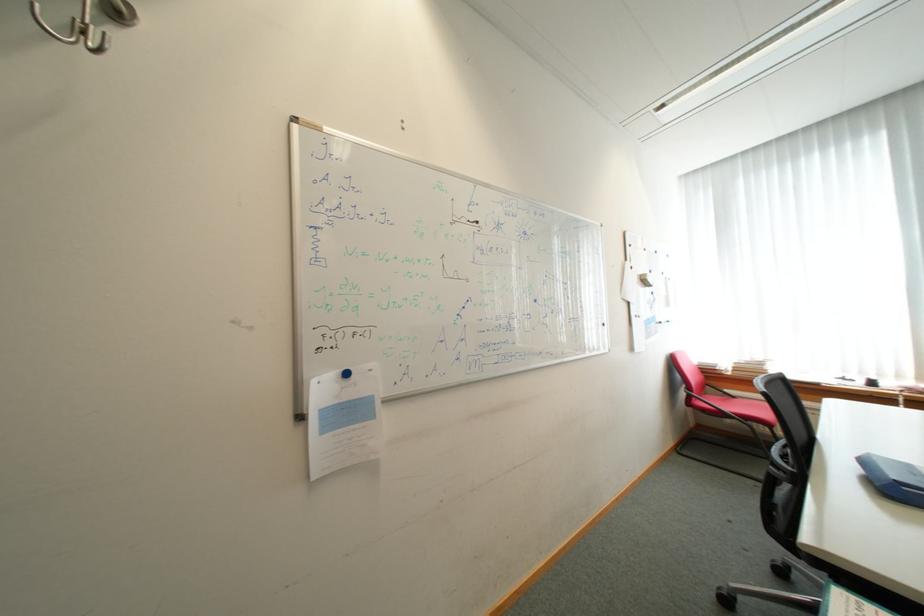
Where is `red chair sitting surface`? red chair sitting surface is located at coordinates tap(730, 402).